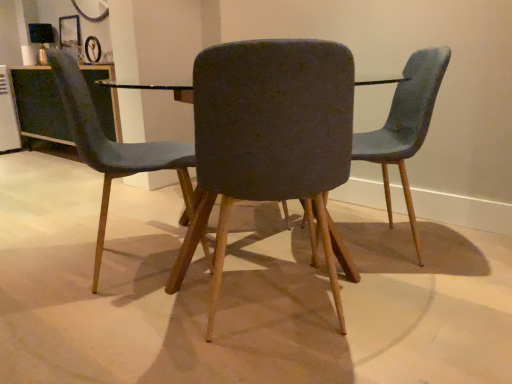
Locate an element on the screen. vacant space behind velvet blue chair at left, the 1th chair in the left-to-right sequence is located at coordinates (134, 222).